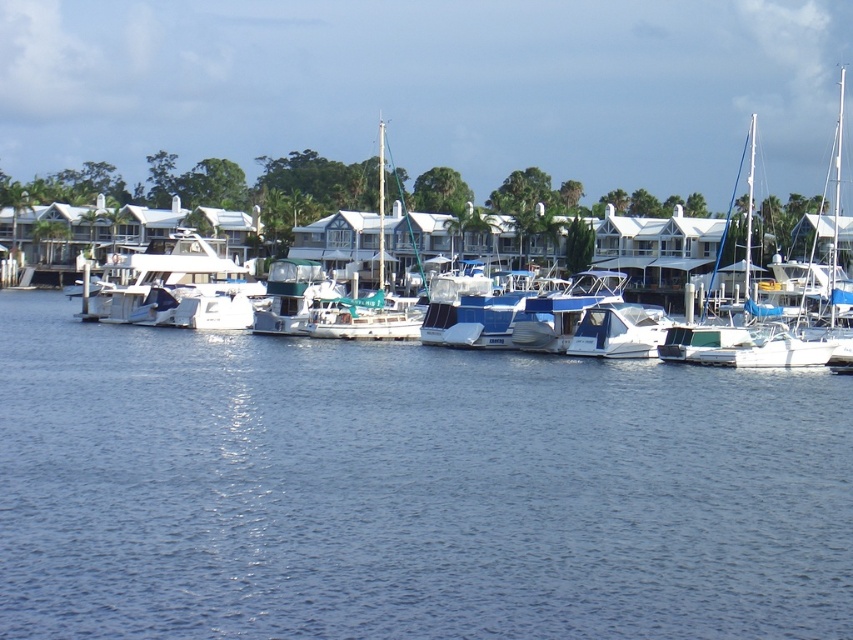
You are a photographer planning to capture the blue water at center and the white matte boat at center in a single frame. Based on their sizes, which one will occupy more space in your photo?

The white matte boat at center will occupy more space in the photo because the blue water at center has a smaller size compared to it.

You are planning to take a small kayak through the blue water at center and the white matte boat at center. Based on their widths, which one do you think will allow the kayak to pass through more easily?

The white matte boat at center has a greater width than the blue water at center, so the kayak would pass through more easily through the white matte boat at center.